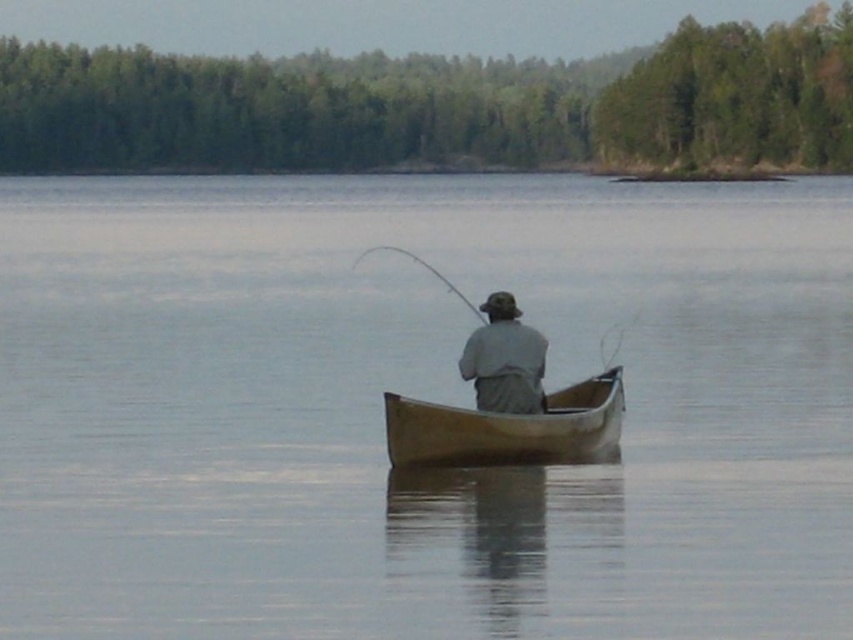
Question: Among these objects, which one is nearest to the camera?

Choices:
 (A) gray fabric fisherman at center
 (B) clear water at center
 (C) wooden canoe at center

Answer: (B)

Question: Considering the real-world distances, which object is closest to the clear water at center?

Choices:
 (A) wooden canoe at center
 (B) flexible fiberglass rod at center
 (C) gray fabric fisherman at center

Answer: (C)

Question: Does clear water at center appear over wooden canoe at center?

Choices:
 (A) no
 (B) yes

Answer: (B)

Question: Can you confirm if gray fabric fisherman at center is wider than flexible fiberglass rod at center?

Choices:
 (A) no
 (B) yes

Answer: (A)

Question: Does gray fabric fisherman at center appear over flexible fiberglass rod at center?

Choices:
 (A) no
 (B) yes

Answer: (A)

Question: Which point is farther to the camera?

Choices:
 (A) (409, 253)
 (B) (515, 348)

Answer: (A)